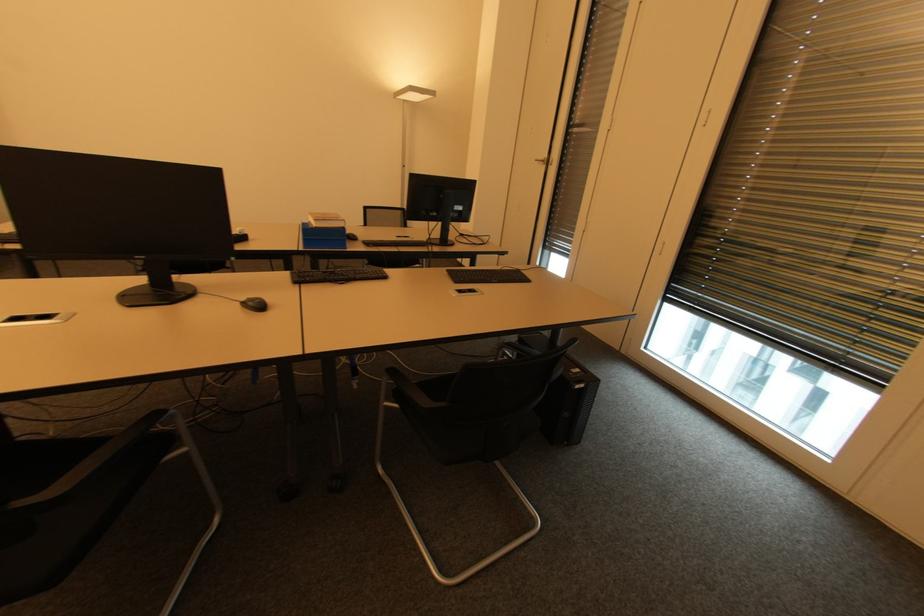
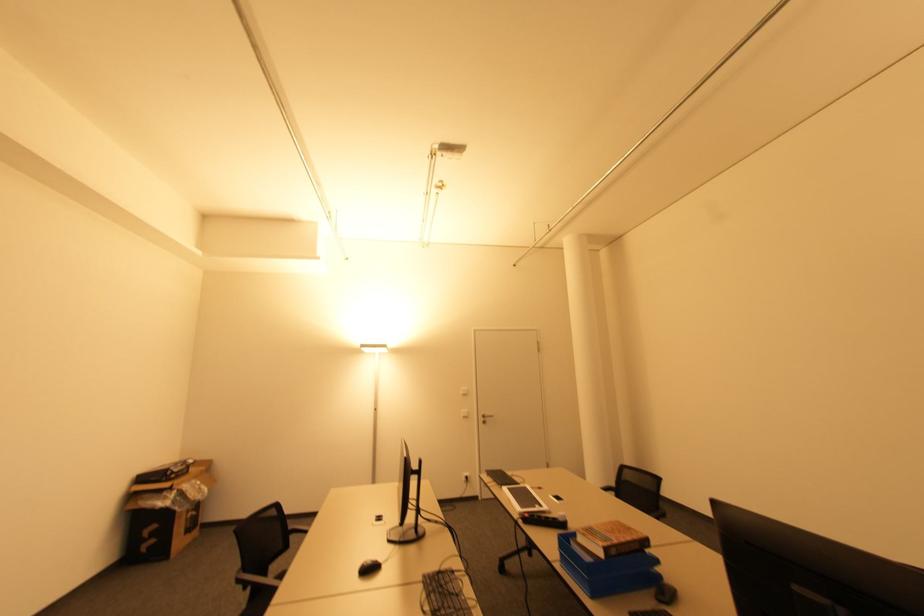
The point at (347, 249) is marked in the first image. Where is the corresponding point in the second image?

(594, 597)